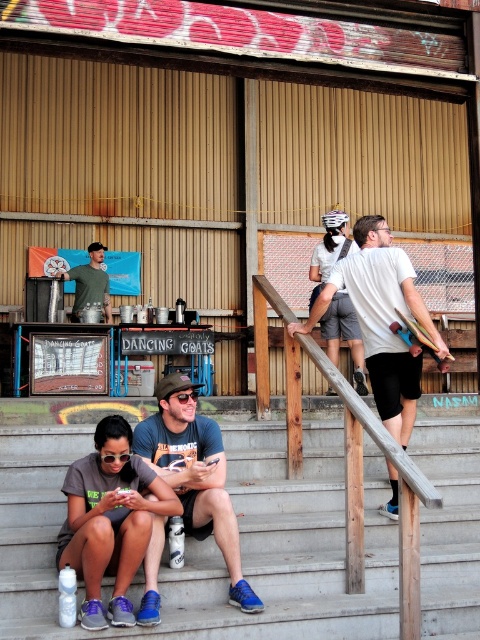
Locate an element on the screen. matte black skateboard at lower left is located at coordinates (109, 518).

Does matte black skateboard at lower left appear under matte blue shorts at lower center?

Indeed, matte black skateboard at lower left is positioned under matte blue shorts at lower center.

Is point (96, 609) closer to viewer compared to point (240, 609)?

Yes, point (96, 609) is closer to viewer.

Where is `matte black skateboard at lower left`? matte black skateboard at lower left is located at coordinates (109, 518).

Is the position of matte blue shorts at lower center more distant than that of matte black shirt at center?

No, it is in front of matte black shirt at center.

Can you confirm if matte blue shorts at lower center is bigger than matte black shirt at center?

Yes.

Between point (206, 460) and point (74, 296), which one is positioned in front?

Positioned in front is point (206, 460).

I want to click on matte blue shorts at lower center, so click(x=194, y=474).

Which of these two, matte black skateboard at lower left or wooden skateboard at upper right, stands shorter?

wooden skateboard at upper right is shorter.

Can you confirm if matte black skateboard at lower left is wider than wooden skateboard at upper right?

Correct, the width of matte black skateboard at lower left exceeds that of wooden skateboard at upper right.

Locate an element on the screen. matte black skateboard at lower left is located at coordinates (109, 518).

Find the location of a particular element. This screenshot has width=480, height=640. matte black skateboard at lower left is located at coordinates (109, 518).